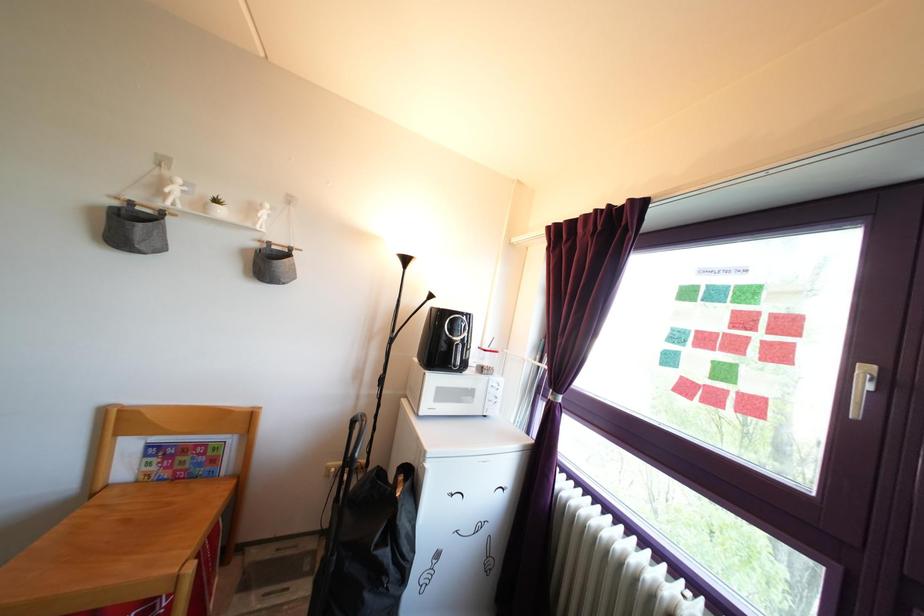
What are the coordinates of `silver window handle` in the screenshot? It's located at (861, 387).